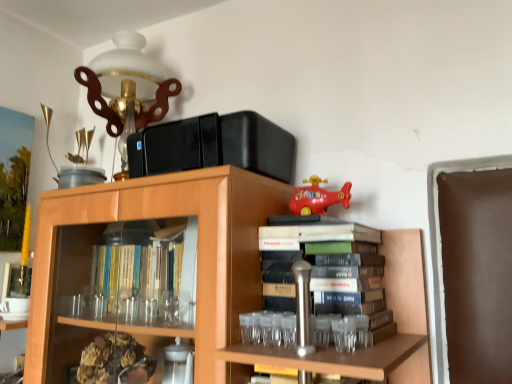
Question: Is matte plastic toy helicopter at upper right behind wooden bookcase at upper center?

Choices:
 (A) no
 (B) yes

Answer: (B)

Question: Is matte plastic toy helicopter at upper right touching wooden bookcase at upper center?

Choices:
 (A) no
 (B) yes

Answer: (A)

Question: Can you confirm if matte plastic toy helicopter at upper right is wider than wooden bookcase at upper center?

Choices:
 (A) yes
 (B) no

Answer: (B)

Question: Is matte plastic toy helicopter at upper right looking in the opposite direction of wooden bookcase at upper center?

Choices:
 (A) no
 (B) yes

Answer: (B)

Question: From a real-world perspective, is matte plastic toy helicopter at upper right physically above wooden bookcase at upper center?

Choices:
 (A) yes
 (B) no

Answer: (A)

Question: Is point (295, 192) positioned closer to the camera than point (151, 102)?

Choices:
 (A) closer
 (B) farther

Answer: (A)

Question: Considering the positions of matte plastic toy helicopter at upper right and matte white glass table lamp at upper left in the image, is matte plastic toy helicopter at upper right taller or shorter than matte white glass table lamp at upper left?

Choices:
 (A) tall
 (B) short

Answer: (B)

Question: Considering the positions of matte plastic toy helicopter at upper right and matte white glass table lamp at upper left in the image, is matte plastic toy helicopter at upper right wider or thinner than matte white glass table lamp at upper left?

Choices:
 (A) wide
 (B) thin

Answer: (B)

Question: From a real-world perspective, is matte plastic toy helicopter at upper right above or below matte white glass table lamp at upper left?

Choices:
 (A) below
 (B) above

Answer: (A)

Question: Is point (349, 183) positioned closer to the camera than point (48, 321)?

Choices:
 (A) farther
 (B) closer

Answer: (B)

Question: Would you say matte plastic toy helicopter at upper right is to the left or to the right of wooden bookcase at upper center in the picture?

Choices:
 (A) right
 (B) left

Answer: (A)

Question: Considering their positions, is matte plastic toy helicopter at upper right located in front of or behind wooden bookcase at upper center?

Choices:
 (A) behind
 (B) front

Answer: (A)

Question: Looking at their shapes, would you say matte plastic toy helicopter at upper right is wider or thinner than wooden bookcase at upper center?

Choices:
 (A) wide
 (B) thin

Answer: (B)

Question: From the image's perspective, is wooden bookcase at upper center positioned above or below matte white glass table lamp at upper left?

Choices:
 (A) below
 (B) above

Answer: (A)

Question: Considering the positions of point click(74, 238) and point click(133, 51), is point click(74, 238) closer or farther from the camera than point click(133, 51)?

Choices:
 (A) farther
 (B) closer

Answer: (B)